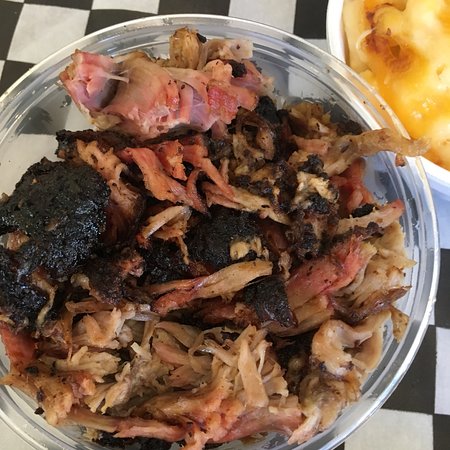
At what (x,y) coordinates should I click in order to perform the action: click on table. Please return your answer as a coordinate pair (x, y). The height and width of the screenshot is (450, 450). Looking at the image, I should click on (417, 410), (6, 435), (99, 10).